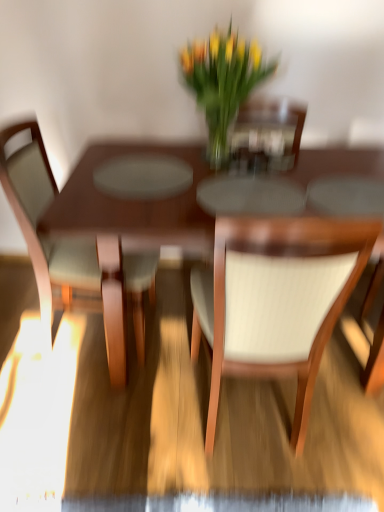
Question: Considering the relative sizes of light brown wood chair at left, the second chair from the right, and white textured chair at center, which appears as the second chair when viewed from the left, in the image provided, is light brown wood chair at left, the second chair from the right, shorter than white textured chair at center, which appears as the second chair when viewed from the left,?

Choices:
 (A) yes
 (B) no

Answer: (A)

Question: Is light brown wood chair at left, marked as the first chair in a left-to-right arrangement, facing towards white textured chair at center, which appears as the second chair when viewed from the left?

Choices:
 (A) no
 (B) yes

Answer: (A)

Question: Is light brown wood chair at left, marked as the first chair in a left-to-right arrangement, to the right of white textured chair at center, the 1th chair in the right-to-left sequence, from the viewer's perspective?

Choices:
 (A) no
 (B) yes

Answer: (A)

Question: Considering the relative positions of light brown wood chair at left, marked as the first chair in a left-to-right arrangement, and white textured chair at center, which appears as the second chair when viewed from the left, in the image provided, is light brown wood chair at left, marked as the first chair in a left-to-right arrangement, in front of white textured chair at center, which appears as the second chair when viewed from the left,?

Choices:
 (A) yes
 (B) no

Answer: (B)

Question: Is light brown wood chair at left, the second chair from the right, smaller than white textured chair at center, the 1th chair in the right-to-left sequence?

Choices:
 (A) no
 (B) yes

Answer: (A)

Question: Considering their positions, is white textured chair at center, which appears as the second chair when viewed from the left, located in front of or behind light brown wood chair at left, the second chair from the right?

Choices:
 (A) front
 (B) behind

Answer: (A)

Question: From their relative heights in the image, would you say white textured chair at center, the 1th chair in the right-to-left sequence, is taller or shorter than light brown wood chair at left, the second chair from the right?

Choices:
 (A) short
 (B) tall

Answer: (B)

Question: Which is correct: white textured chair at center, which appears as the second chair when viewed from the left, is inside light brown wood chair at left, the second chair from the right, or outside of it?

Choices:
 (A) outside
 (B) inside

Answer: (A)

Question: Is white textured chair at center, the 1th chair in the right-to-left sequence, bigger or smaller than light brown wood chair at left, marked as the first chair in a left-to-right arrangement?

Choices:
 (A) small
 (B) big

Answer: (A)

Question: From the image's perspective, is wooden table at center located above or below white textured chair at center, which appears as the second chair when viewed from the left?

Choices:
 (A) above
 (B) below

Answer: (A)

Question: Is wooden table at center wider or thinner than white textured chair at center, which appears as the second chair when viewed from the left?

Choices:
 (A) thin
 (B) wide

Answer: (B)

Question: Is wooden table at center inside or outside of white textured chair at center, which appears as the second chair when viewed from the left?

Choices:
 (A) outside
 (B) inside

Answer: (A)

Question: Is wooden table at center in front of or behind white textured chair at center, the 1th chair in the right-to-left sequence, in the image?

Choices:
 (A) front
 (B) behind

Answer: (B)

Question: Is point (248, 93) closer or farther from the camera than point (299, 250)?

Choices:
 (A) farther
 (B) closer

Answer: (A)

Question: Considering the positions of translucent glass vase at center and white textured chair at center, the 1th chair in the right-to-left sequence, in the image, is translucent glass vase at center taller or shorter than white textured chair at center, the 1th chair in the right-to-left sequence,?

Choices:
 (A) tall
 (B) short

Answer: (B)